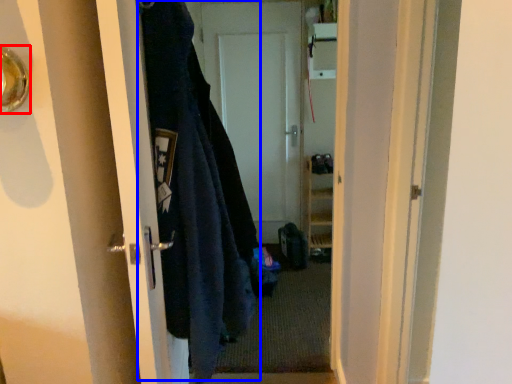
Question: Among these objects, which one is farthest to the camera, door handle (highlighted by a red box) or garment (highlighted by a blue box)?

Choices:
 (A) door handle
 (B) garment

Answer: (B)